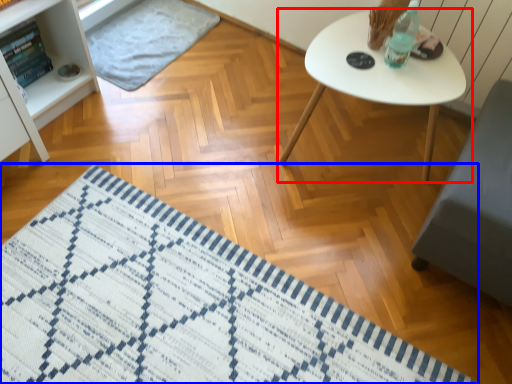
Question: Which object appears closest to the camera in this image, table (highlighted by a red box) or mat (highlighted by a blue box)?

Choices:
 (A) table
 (B) mat

Answer: (B)